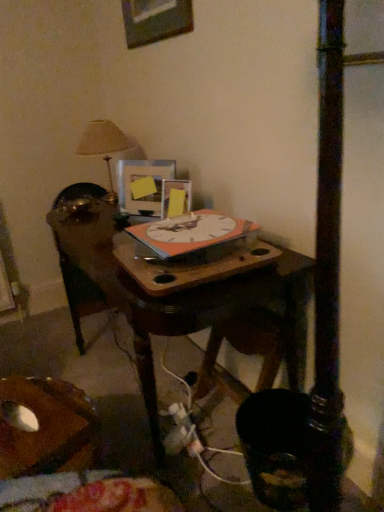
Question: In terms of width, does orange matte clock at center look wider or thinner when compared to matte plastic picture frame at center, which is the second picture frame from bottom to top?

Choices:
 (A) thin
 (B) wide

Answer: (B)

Question: From a real-world perspective, is orange matte clock at center above or below matte plastic picture frame at center, the 2th picture frame in the top-to-bottom sequence?

Choices:
 (A) above
 (B) below

Answer: (B)

Question: Which of these objects is positioned farthest from the matte plastic picture frame at center, the 2th picture frame in the top-to-bottom sequence?

Choices:
 (A) wooden table at center
 (B) wooden picture frame at upper center, positioned as the third picture frame in bottom-to-top order
 (C) white plastic plug at lower center
 (D) orange matte clock at center
 (E) matte plastic picture frame at center, which is counted as the first picture frame, starting from the bottom

Answer: (C)

Question: Which of these objects is positioned closest to the matte plastic picture frame at center, which is counted as the first picture frame, starting from the bottom?

Choices:
 (A) matte beige lampshade at upper left
 (B) matte plastic picture frame at center, which is the second picture frame from bottom to top
 (C) wooden picture frame at upper center, positioned as the third picture frame in bottom-to-top order
 (D) wooden table at center
 (E) white plastic plug at lower center

Answer: (B)